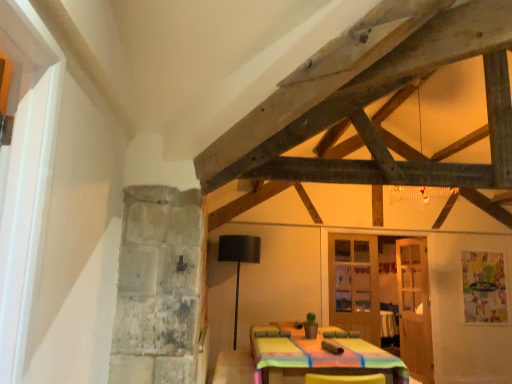
Question: Are matte glass door at center, which is the 2th door from back to front, and wooden door at right, which is the 3th door from front to back, making contact?

Choices:
 (A) yes
 (B) no

Answer: (B)

Question: Considering the relative sizes of matte glass door at center, the 2th door positioned from the front, and wooden door at right, which is the 3th door from front to back, in the image provided, is matte glass door at center, the 2th door positioned from the front, taller than wooden door at right, which is the 3th door from front to back,?

Choices:
 (A) no
 (B) yes

Answer: (A)

Question: Is matte glass door at center, the 2th door positioned from the front, outside wooden door at right, which is the 3th door from front to back?

Choices:
 (A) no
 (B) yes

Answer: (B)

Question: Can you confirm if matte glass door at center, which is the 2th door from back to front, is thinner than wooden door at right, acting as the first door starting from the back?

Choices:
 (A) no
 (B) yes

Answer: (B)

Question: Would you consider matte glass door at center, which is the 2th door from back to front, to be distant from wooden door at right, which is the 3th door from front to back?

Choices:
 (A) no
 (B) yes

Answer: (A)

Question: Looking at their shapes, would you say black matte lamp at center is wider or thinner than matte glass door at center, the 2th door positioned from the front?

Choices:
 (A) wide
 (B) thin

Answer: (A)

Question: Looking at the image, does black matte lamp at center seem bigger or smaller compared to matte glass door at center, the 2th door positioned from the front?

Choices:
 (A) small
 (B) big

Answer: (B)

Question: From a real-world perspective, is black matte lamp at center positioned above or below matte glass door at center, the 2th door positioned from the front?

Choices:
 (A) below
 (B) above

Answer: (A)

Question: Does point (237, 243) appear closer or farther from the camera than point (360, 248)?

Choices:
 (A) farther
 (B) closer

Answer: (B)

Question: From a real-world perspective, is black matte lamp at center physically located above or below wooden door at right, acting as the first door starting from the back?

Choices:
 (A) above
 (B) below

Answer: (B)

Question: From the image's perspective, is black matte lamp at center located above or below wooden door at right, acting as the first door starting from the back?

Choices:
 (A) above
 (B) below

Answer: (A)

Question: Is black matte lamp at center to the left or to the right of wooden door at right, acting as the first door starting from the back, in the image?

Choices:
 (A) left
 (B) right

Answer: (A)

Question: Is black matte lamp at center in front of or behind wooden door at right, which is the 3th door from front to back, in the image?

Choices:
 (A) behind
 (B) front

Answer: (B)

Question: Considering their positions, is matte glass door at center, which is the 2th door from back to front, located in front of or behind wooden glass door at center, the third door in the back-to-front sequence?

Choices:
 (A) front
 (B) behind

Answer: (B)

Question: Is point (352, 261) closer or farther from the camera than point (403, 294)?

Choices:
 (A) closer
 (B) farther

Answer: (A)